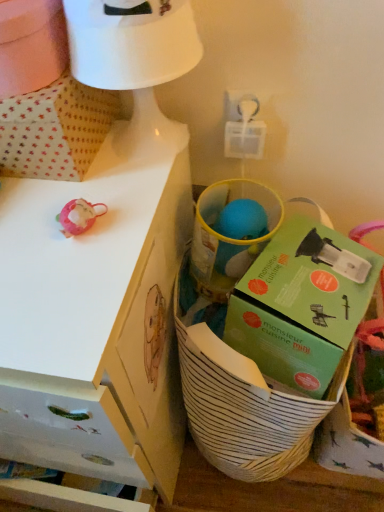
Image resolution: width=384 pixels, height=512 pixels. What do you see at coordinates (55, 130) in the screenshot? I see `white dotted fabric at upper left` at bounding box center [55, 130].

This screenshot has width=384, height=512. What do you see at coordinates (244, 405) in the screenshot? I see `white striped basket at lower right` at bounding box center [244, 405].

The width and height of the screenshot is (384, 512). What are the coordinates of `white matte table lamp at upper center` in the screenshot? It's located at (131, 42).

Between point (117, 50) and point (301, 452), which one is positioned behind?

The point (301, 452) is farther.

Between white matte table lamp at upper center and white striped basket at lower right, which one has more height?

With more height is white striped basket at lower right.

From a real-world perspective, does white matte table lamp at upper center stand above white striped basket at lower right?

Yes, from a real-world perspective, white matte table lamp at upper center is over white striped basket at lower right

Is white matte table lamp at upper center not within white striped basket at lower right?

Indeed, white matte table lamp at upper center is completely outside white striped basket at lower right.

Is green cardboard box at center in front of or behind white matte table lamp at upper center in the image?

Clearly, green cardboard box at center is behind white matte table lamp at upper center.

Does green cardboard box at center contain white matte table lamp at upper center?

No, white matte table lamp at upper center is not a part of green cardboard box at center.

Is green cardboard box at center taller or shorter than white matte table lamp at upper center?

In the image, green cardboard box at center appears to be shorter than white matte table lamp at upper center.

From the image's perspective, which one is positioned lower, green cardboard box at center or white matte table lamp at upper center?

green cardboard box at center.

Looking at the image, does white matte desk at upper left seem bigger or smaller compared to green cardboard box at center?

Considering their sizes, white matte desk at upper left takes up more space than green cardboard box at center.

In the scene shown: From the image's perspective, is white matte desk at upper left on green cardboard box at center?

No.

Locate an element on the screen. Image resolution: width=384 pixels, height=512 pixels. box on the right of white matte desk at upper left is located at coordinates (302, 304).

Considering the sizes of objects white matte desk at upper left and white dotted fabric at upper left in the image provided, who is thinner, white matte desk at upper left or white dotted fabric at upper left?

white dotted fabric at upper left.

Would you consider white matte desk at upper left to be distant from white dotted fabric at upper left?

white matte desk at upper left is near white dotted fabric at upper left, not far away.

Between white matte desk at upper left and white dotted fabric at upper left, which one has larger size?

Bigger between the two is white matte desk at upper left.

Does point (111, 408) come closer to viewer compared to point (68, 159)?

Yes, it is in front of point (68, 159).

From a real-world perspective, which is physically above, white matte table lamp at upper center or white matte desk at upper left?

white matte table lamp at upper center, from a real-world perspective.

I want to click on table lamp behind the white matte desk at upper left, so (131, 42).

Which object is positioned more to the right, white matte table lamp at upper center or white matte desk at upper left?

From the viewer's perspective, white matte table lamp at upper center appears more on the right side.

Can you confirm if white matte table lamp at upper center is smaller than white matte desk at upper left?

Indeed, white matte table lamp at upper center has a smaller size compared to white matte desk at upper left.

Based on the photo, how far apart are white dotted fabric at upper left and white matte desk at upper left?

A distance of 8.84 inches exists between white dotted fabric at upper left and white matte desk at upper left.

Is white matte desk at upper left at the back of white dotted fabric at upper left?

That's not correct — white dotted fabric at upper left is not looking away from white matte desk at upper left.

Between white dotted fabric at upper left and white matte desk at upper left, which one has larger width?

Wider between the two is white matte desk at upper left.

Consider the image. Which is nearer, (21, 170) or (93, 257)?

The point (93, 257) is closer.

Does white dotted fabric at upper left have a larger size compared to white matte table lamp at upper center?

Yes.

Is white matte table lamp at upper center a part of white dotted fabric at upper left?

No, white matte table lamp at upper center is not inside white dotted fabric at upper left.

Does white dotted fabric at upper left lie behind white matte table lamp at upper center?

Yes.

Can you tell me how much white dotted fabric at upper left and white matte table lamp at upper center differ in facing direction?

white dotted fabric at upper left and white matte table lamp at upper center are facing 0.000504 degrees away from each other.

Where is `basket located on the right of white matte table lamp at upper center`? Image resolution: width=384 pixels, height=512 pixels. basket located on the right of white matte table lamp at upper center is located at coordinates (244, 405).

You are a GUI agent. You are given a task and a screenshot of the screen. Output one action in this format:
    pyautogui.click(x=<x>, y=<y>)
    Task: Click on the box behind the white matte table lamp at upper center
    
    Given the screenshot: What is the action you would take?
    pyautogui.click(x=302, y=304)

Based on their spatial positions, is white matte table lamp at upper center or green cardboard box at center closer to white striped basket at lower right?

Among the two, green cardboard box at center is located nearer to white striped basket at lower right.

Consider the image. Which object lies further to the anchor point white matte table lamp at upper center, green cardboard box at center or white dotted fabric at upper left?

green cardboard box at center is positioned further to the anchor white matte table lamp at upper center.

Which object lies nearer to the anchor point white dotted fabric at upper left, white matte desk at upper left or white striped basket at lower right?

white matte desk at upper left.

Which object lies further to the anchor point green cardboard box at center, white matte table lamp at upper center or white matte desk at upper left?

white matte table lamp at upper center is further to green cardboard box at center.

From the image, which object appears to be nearer to white matte desk at upper left, white dotted fabric at upper left or white striped basket at lower right?

white striped basket at lower right.

Considering their positions, is white dotted fabric at upper left positioned further to green cardboard box at center than white striped basket at lower right?

The object further to green cardboard box at center is white dotted fabric at upper left.

From the image, which object appears to be farther from white dotted fabric at upper left, white matte table lamp at upper center or green cardboard box at center?

green cardboard box at center is further to white dotted fabric at upper left.

Estimate the real-world distances between objects in this image. Which object is closer to white dotted fabric at upper left, white striped basket at lower right or green cardboard box at center?

green cardboard box at center is positioned closer to the anchor white dotted fabric at upper left.

Locate an element on the screen. cardboard box between white matte desk at upper left and white striped basket at lower right from left to right is located at coordinates (55, 130).

Locate an element on the screen. The height and width of the screenshot is (512, 384). basket between white dotted fabric at upper left and green cardboard box at center in the horizontal direction is located at coordinates (244, 405).

Locate an element on the screen. desk between white matte table lamp at upper center and white striped basket at lower right vertically is located at coordinates (96, 318).

Identify the location of box between white matte table lamp at upper center and white striped basket at lower right from top to bottom. (302, 304).